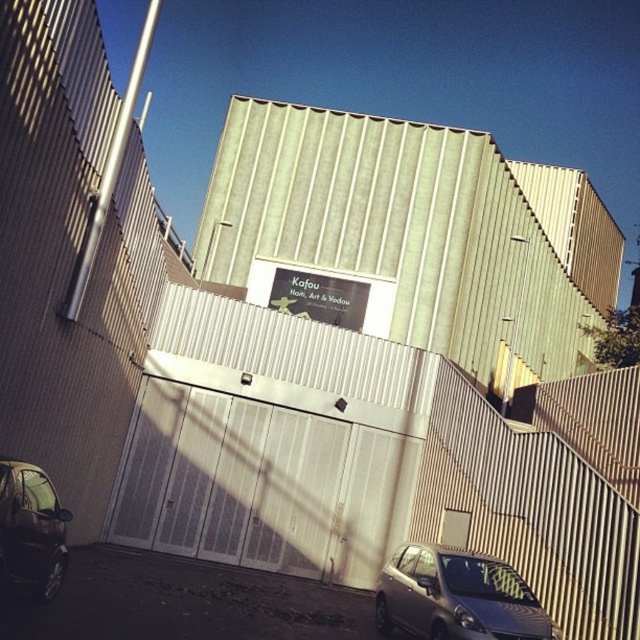
In order to click on satin silver hatchback at lower right in this screenshot , I will do `click(456, 596)`.

Is satin silver hatchback at lower right to the right of shiny silver car at lower left from the viewer's perspective?

Correct, you'll find satin silver hatchback at lower right to the right of shiny silver car at lower left.

The width and height of the screenshot is (640, 640). Find the location of `satin silver hatchback at lower right`. satin silver hatchback at lower right is located at coordinates (456, 596).

Locate an element on the screen. This screenshot has height=640, width=640. satin silver hatchback at lower right is located at coordinates (456, 596).